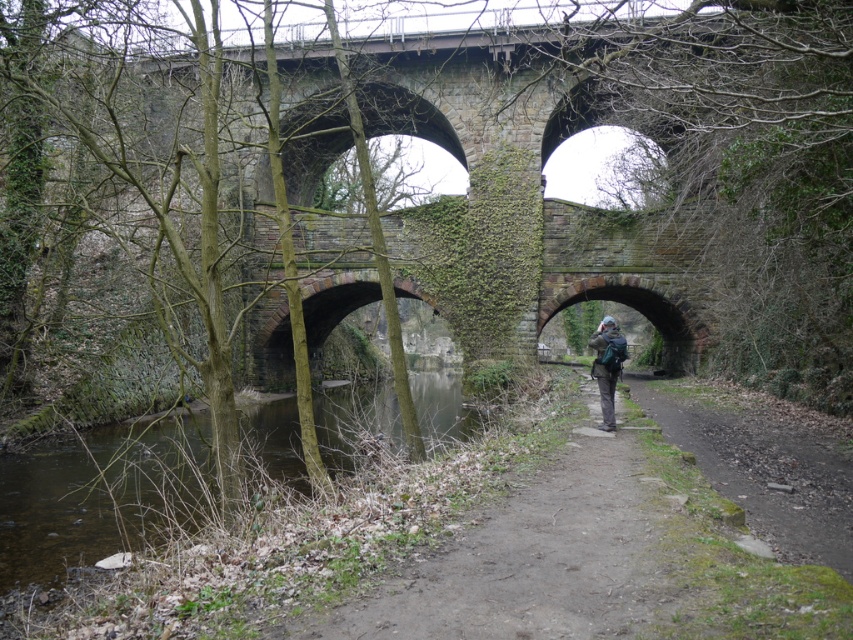
You are standing at the point marked as point (538, 556) in the image. What is the name of the object located exactly at that point?

The object located at point (538, 556) is the dirt path at center.

You are standing on the stone bridge and looking at two points marked on the bridge. The first point is at coordinates point (265, 472) and the second point is at point (813, 428). Which point is nearer to you?

Point (265, 472) is closer to the camera than point (813, 428), so the first point is nearer to you.

You are standing on the dirt path at center and want to reach the green mossy water at lower left. Which direction should you move to get closer to the water?

Since the dirt path at center is in front of green mossy water at lower left, you should move backward to reach the green mossy water at lower left.